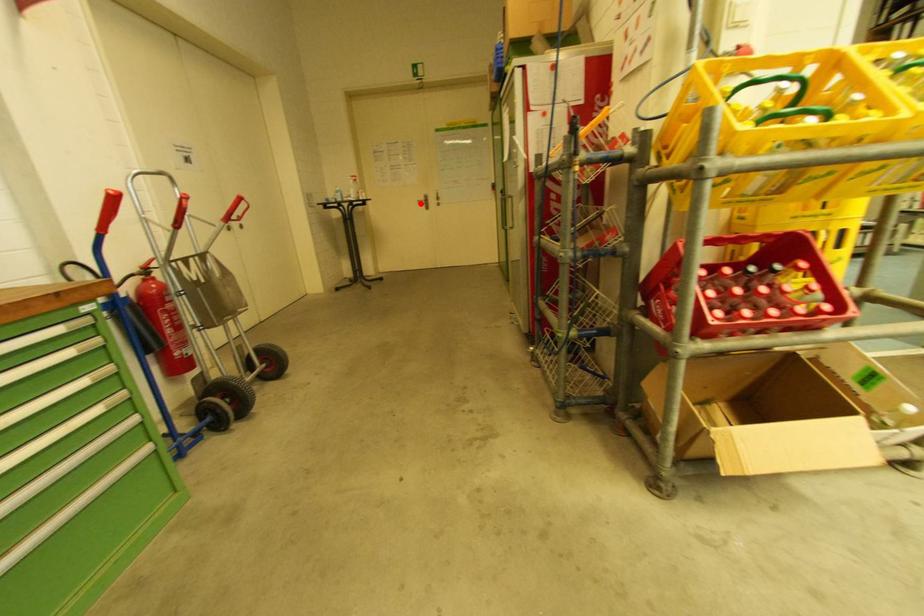
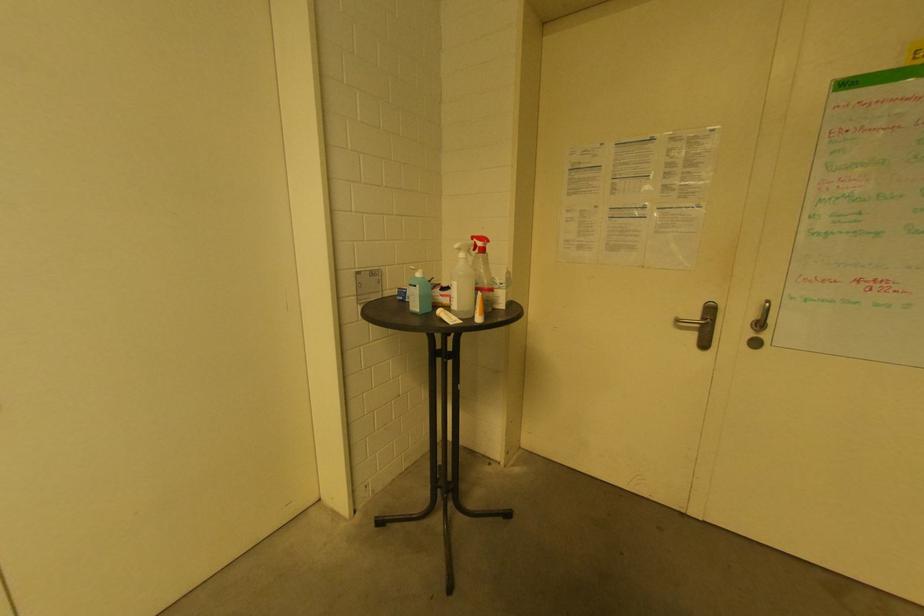
In the second image, find the point that corresponds to the highlighted location in the first image.

(681, 323)